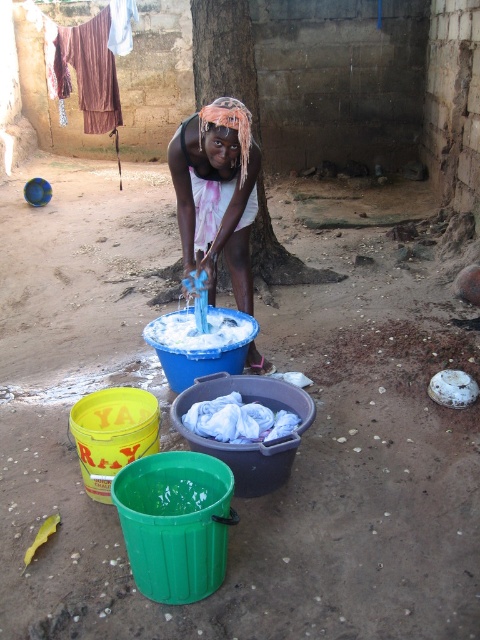
Question: Which point is farther to the camera?

Choices:
 (A) (245, 118)
 (B) (323, 273)

Answer: (B)

Question: Which point is closer to the camera?

Choices:
 (A) (201, 120)
 (B) (259, 269)

Answer: (A)

Question: From the image, what is the correct spatial relationship of white fabric at center in relation to brown rough tree trunk at center?

Choices:
 (A) left
 (B) right

Answer: (B)

Question: Is white fabric at center bigger than brown rough tree trunk at center?

Choices:
 (A) no
 (B) yes

Answer: (B)

Question: Can you confirm if white fabric at center is positioned to the right of brown rough tree trunk at center?

Choices:
 (A) no
 (B) yes

Answer: (B)

Question: Which point is closer to the camera?

Choices:
 (A) (250, 280)
 (B) (217, 35)

Answer: (A)